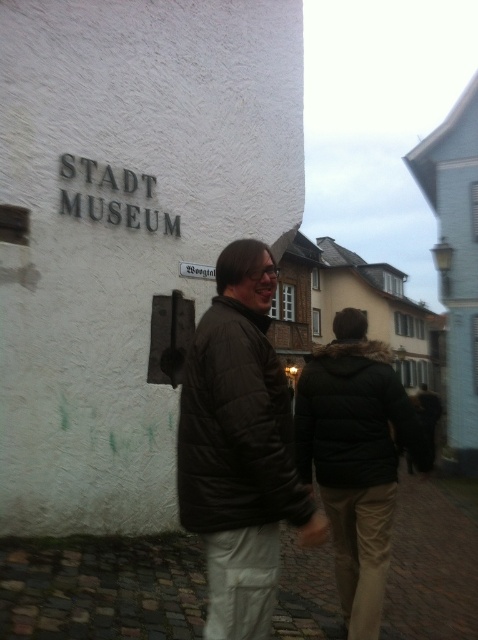
You are standing in front of the STADT MUSEUM building and see a dark green jacket at center and a white plastic sign at center. Which object is positioned to the right of the other?

The dark green jacket at center is positioned to the right of the white plastic sign at center.

You are standing at the entrance of the STADT MUSEUM. You see a point marked at coordinates (357,458). Which object does this point correspond to?

The point at coordinates (357,458) corresponds to the dark green jacket at center.